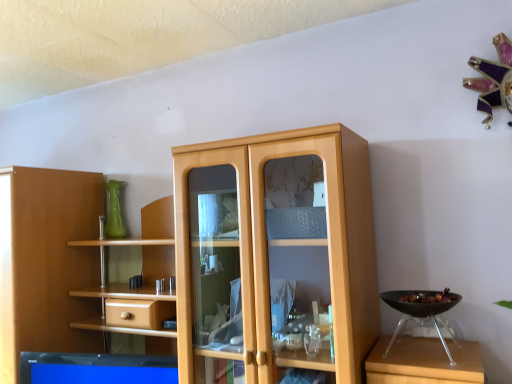
Question: Can we say green glass vase at upper left lies outside black plastic bowl at right?

Choices:
 (A) no
 (B) yes

Answer: (B)

Question: Does green glass vase at upper left come behind black plastic bowl at right?

Choices:
 (A) no
 (B) yes

Answer: (B)

Question: Is green glass vase at upper left surrounding black plastic bowl at right?

Choices:
 (A) no
 (B) yes

Answer: (A)

Question: Could you tell me if green glass vase at upper left is turned towards black plastic bowl at right?

Choices:
 (A) yes
 (B) no

Answer: (B)

Question: Is green glass vase at upper left looking in the opposite direction of black plastic bowl at right?

Choices:
 (A) yes
 (B) no

Answer: (B)

Question: Is light wood cupboard at center bigger or smaller than green glass vase at upper left?

Choices:
 (A) small
 (B) big

Answer: (B)

Question: From a real-world perspective, is light wood cupboard at center physically located above or below green glass vase at upper left?

Choices:
 (A) above
 (B) below

Answer: (B)

Question: Considering their positions, is light wood cupboard at center located in front of or behind green glass vase at upper left?

Choices:
 (A) front
 (B) behind

Answer: (A)

Question: Which is correct: light wood cupboard at center is inside green glass vase at upper left, or outside of it?

Choices:
 (A) inside
 (B) outside

Answer: (B)

Question: From their relative heights in the image, would you say light wood cupboard at center is taller or shorter than black plastic bowl at right?

Choices:
 (A) tall
 (B) short

Answer: (A)

Question: Considering the relative positions of light wood cupboard at center and black plastic bowl at right in the image provided, is light wood cupboard at center to the left or to the right of black plastic bowl at right?

Choices:
 (A) right
 (B) left

Answer: (B)

Question: From the image's perspective, relative to black plastic bowl at right, is light wood cupboard at center above or below?

Choices:
 (A) above
 (B) below

Answer: (B)

Question: Does point (223, 375) appear closer or farther from the camera than point (452, 304)?

Choices:
 (A) farther
 (B) closer

Answer: (A)

Question: Considering their positions, is black plastic bowl at right located in front of or behind light wood cupboard at center?

Choices:
 (A) behind
 (B) front

Answer: (A)

Question: Is black plastic bowl at right bigger or smaller than light wood cupboard at center?

Choices:
 (A) big
 (B) small

Answer: (B)